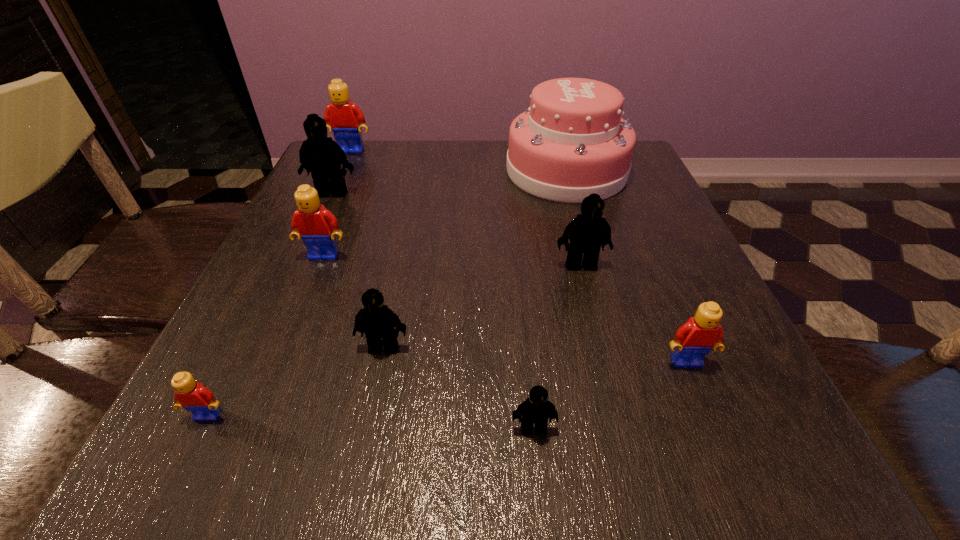
Locate an element on the screen. This screenshot has width=960, height=540. cake is located at coordinates (571, 142).

Where is `the leftmost black Lego`? The image size is (960, 540). the leftmost black Lego is located at coordinates (321, 155).

The height and width of the screenshot is (540, 960). In order to click on the farthest black Lego in this screenshot , I will do `click(321, 155)`.

This screenshot has height=540, width=960. What are the coordinates of `the farthest yellow Lego` in the screenshot? It's located at (344, 118).

Image resolution: width=960 pixels, height=540 pixels. I want to click on the biggest yellow Lego, so click(344, 118).

Locate an element on the screen. This screenshot has width=960, height=540. the second biggest black Lego is located at coordinates (587, 232).

The width and height of the screenshot is (960, 540). Find the location of `the third nearest black Lego`. the third nearest black Lego is located at coordinates (587, 232).

The height and width of the screenshot is (540, 960). What are the coordinates of `the third nearest yellow Lego` in the screenshot? It's located at (312, 222).

Where is `the third black Lego from right to left`? This screenshot has width=960, height=540. the third black Lego from right to left is located at coordinates (376, 320).

Locate an element on the screen. This screenshot has width=960, height=540. the fifth Lego from left to right is located at coordinates (376, 320).